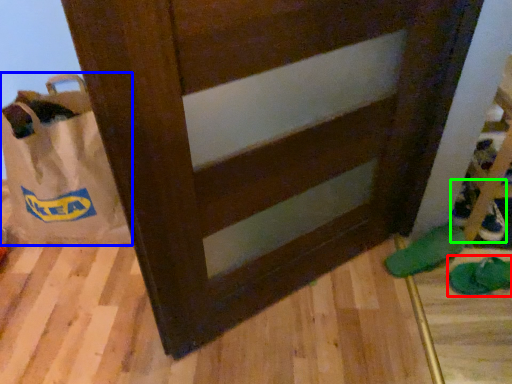
Question: Based on their relative distances, which object is nearer to footwear (highlighted by a red box)? Choose from grocery bag (highlighted by a blue box) and shoe (highlighted by a green box).

Choices:
 (A) grocery bag
 (B) shoe

Answer: (B)